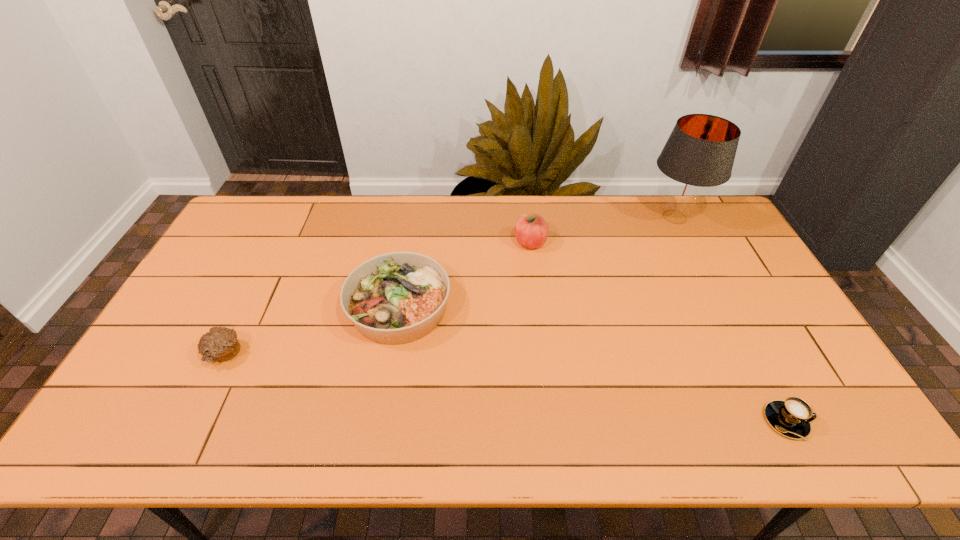
Locate an element on the screen. This screenshot has height=540, width=960. free region located 0.340m on the right of the salad plate is located at coordinates (568, 307).

In order to click on free space located 0.340m on the back of the leftmost object in this screenshot , I will do `click(274, 255)`.

Find the location of a particular element. Image resolution: width=960 pixels, height=540 pixels. free space located on the back of the nearest object is located at coordinates (735, 324).

The height and width of the screenshot is (540, 960). Identify the location of lampshade that is at the far edge. coord(699,154).

Where is `apple that is at the far edge`? Image resolution: width=960 pixels, height=540 pixels. apple that is at the far edge is located at coordinates (531, 230).

I want to click on object located in the near edge section of the desktop, so click(x=792, y=417).

Locate an element on the screen. object present at the left edge is located at coordinates (219, 344).

You are a GUI agent. You are given a task and a screenshot of the screen. Output one action in this format:
    pyautogui.click(x=<x>, y=<y>)
    Task: Click on the lampshade at the right edge
    
    Given the screenshot: What is the action you would take?
    pyautogui.click(x=699, y=154)

The image size is (960, 540). I want to click on cappuccino located in the right edge section of the desktop, so click(x=792, y=417).

At what (x,y) coordinates should I click in order to perform the action: click on object that is positioned at the far right corner. Please return your answer as a coordinate pair (x, y). This screenshot has height=540, width=960. Looking at the image, I should click on [x=699, y=154].